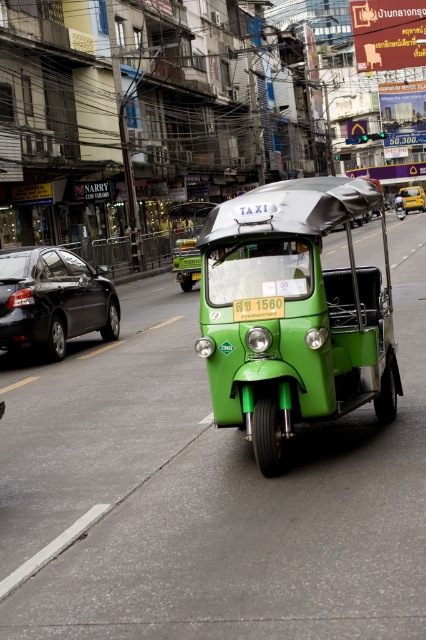
Does point (52, 250) lie behind point (235, 316)?

That is True.

Who is shorter, shiny black sedan at left or green plastic license plate at center?

green plastic license plate at center is shorter.

Between point (109, 288) and point (270, 308), which one is positioned in front?

Positioned in front is point (270, 308).

You are a GUI agent. You are given a task and a screenshot of the screen. Output one action in this format:
    pyautogui.click(x=<x>, y=<y>)
    Task: Click on the shiny black sedan at left
    This screenshot has height=640, width=426.
    Given the screenshot: What is the action you would take?
    pyautogui.click(x=52, y=300)

Between green plastic license plate at center and green matte taxi at center, which one is positioned higher?

green matte taxi at center

Is green plastic license plate at center smaller than green matte taxi at center?

Yes, green plastic license plate at center is smaller than green matte taxi at center.

This screenshot has width=426, height=640. What do you see at coordinates (258, 308) in the screenshot?
I see `green plastic license plate at center` at bounding box center [258, 308].

Where is `green plastic license plate at center`? green plastic license plate at center is located at coordinates coord(258,308).

Between shiny black sedan at left and green matte taxi at center, which one has more height?

With more height is green matte taxi at center.

Based on the photo, is shiny black sedan at left thinner than green matte taxi at center?

Indeed, shiny black sedan at left has a lesser width compared to green matte taxi at center.

Between point (75, 257) and point (414, 196), which one is positioned in front?

Point (75, 257) is more forward.

Locate an element on the screen. shiny black sedan at left is located at coordinates (52, 300).